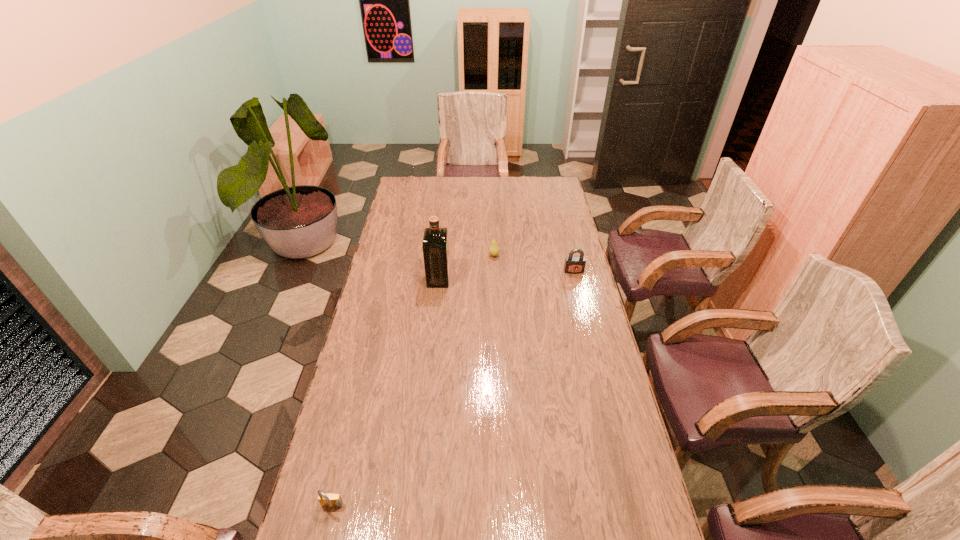
Image resolution: width=960 pixels, height=540 pixels. Identify the location of vacant area between the nearest object and the liquor. (385, 393).

Find the location of a particular element. object that stands as the closest to the leftmost object is located at coordinates (435, 245).

Select which object is the closest to the tallest object. Please provide its 2D coordinates. Your answer should be formatted as a tuple, i.e. [(x, y)], where the tuple contains the x and y coordinates of a point satisfying the conditions above.

[(494, 250)]

This screenshot has height=540, width=960. I want to click on padlock object that ranks as the closest to the third object from right to left, so click(x=573, y=264).

Where is `padlock that is the closest one to the third object from right to left`? padlock that is the closest one to the third object from right to left is located at coordinates (573, 264).

Locate an element on the screen. free location that satisfies the following two spatial constraints: 1. on the front label of the third object from right to left; 2. on the side with the combination dials of the nearest object is located at coordinates (414, 508).